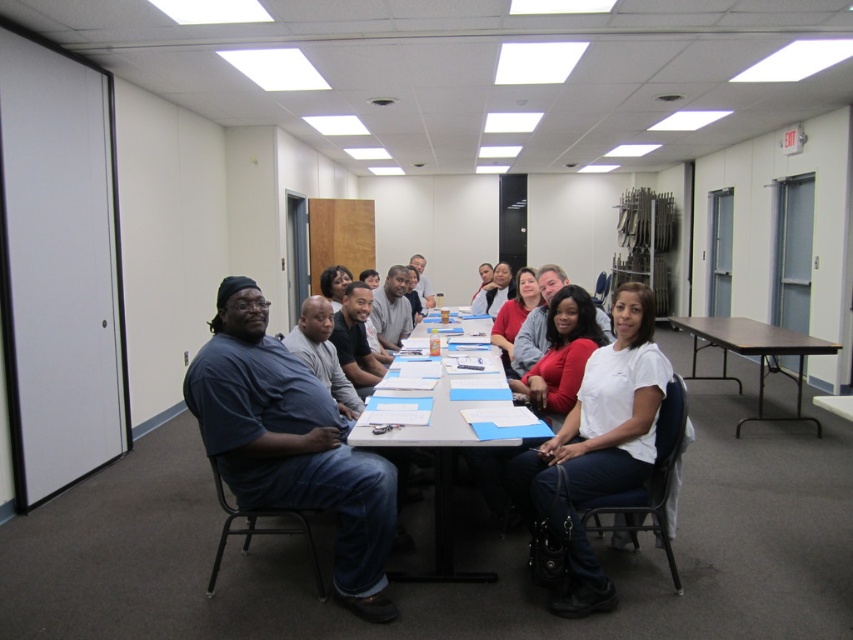
Does point (357, 481) come closer to viewer compared to point (207, 406)?

No, (357, 481) is behind (207, 406).

Who is taller, matte blue shirt at center or dark blue shirt at center?

matte blue shirt at center

Is point (257, 468) positioned behind point (350, 552)?

Yes, point (257, 468) is farther from viewer.

You are a GUI agent. You are given a task and a screenshot of the screen. Output one action in this format:
    pyautogui.click(x=<x>, y=<y>)
    Task: Click on the matte blue shirt at center
    
    Given the screenshot: What is the action you would take?
    pyautogui.click(x=291, y=444)

Between matte blue shirt at center and white matte shirt at center, which one is positioned higher?

white matte shirt at center is above.

Describe the element at coordinates (291, 444) in the screenshot. I see `matte blue shirt at center` at that location.

In the scene shown: Who is more distant from viewer, (x=219, y=300) or (x=577, y=580)?

Positioned behind is point (x=577, y=580).

Identify the location of matte blue shirt at center. (291, 444).

Between white plastic table at center and brown/metallic table at right, which one is positioned lower?

Positioned lower is white plastic table at center.

Does white plastic table at center have a greater width compared to brown/metallic table at right?

A: No.

Between point (415, 435) and point (741, 419), which one is positioned behind?

Positioned behind is point (741, 419).

The height and width of the screenshot is (640, 853). Find the location of `white plastic table at center`. white plastic table at center is located at coordinates (437, 472).